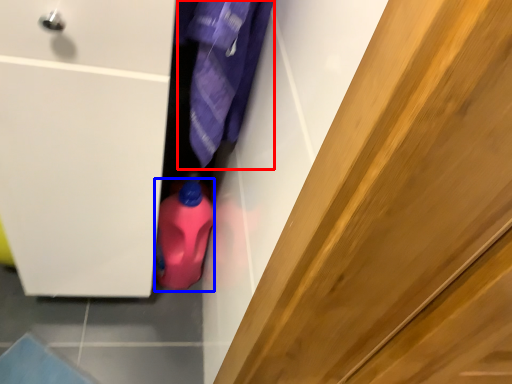
Question: Which object appears closest to the camera in this image, clothing (highlighted by a red box) or cleaning product (highlighted by a blue box)?

Choices:
 (A) clothing
 (B) cleaning product

Answer: (A)